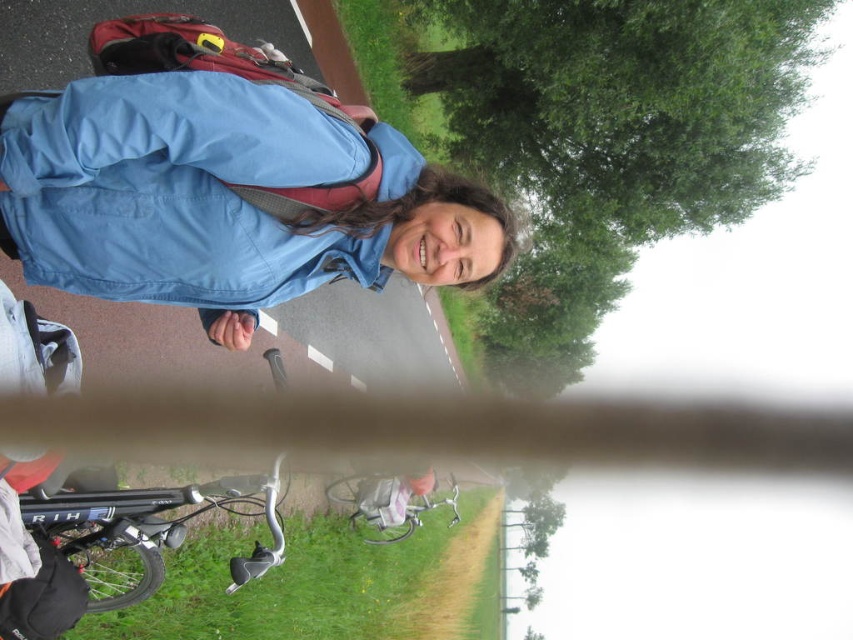
Can you confirm if shiny black bicycle handlebars at lower left is shorter than metallic silver bicycle at lower center?

Yes, shiny black bicycle handlebars at lower left is shorter than metallic silver bicycle at lower center.

Is point (103, 468) farther from camera compared to point (405, 499)?

No.

The height and width of the screenshot is (640, 853). I want to click on shiny black bicycle handlebars at lower left, so click(144, 528).

Is point (134, 118) behind point (160, 516)?

No, it is not.

Who is more distant from viewer, (231,262) or (90,552)?

The point (90,552) is behind.

Find the location of a particular element. Image resolution: width=853 pixels, height=640 pixels. blue fabric jacket at center is located at coordinates point(177,189).

Can you confirm if blue fabric jacket at center is smaller than metallic silver bicycle at lower center?

Indeed, blue fabric jacket at center has a smaller size compared to metallic silver bicycle at lower center.

Measure the distance between point [209,307] and camera.

They are 2.18 meters apart.

Who is more distant from viewer, (41, 221) or (334, 490)?

Positioned behind is point (334, 490).

Locate an element on the screen. blue fabric jacket at center is located at coordinates (177, 189).